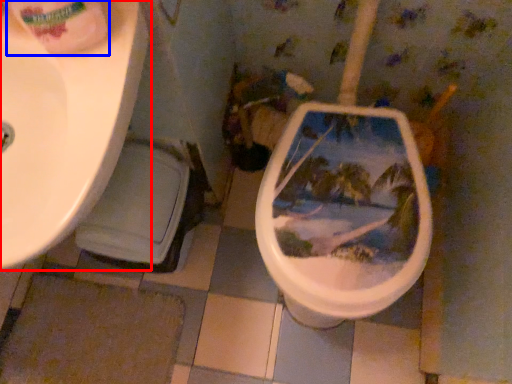
Question: Among these objects, which one is nearest to the camera, sink (highlighted by a red box) or toilet paper (highlighted by a blue box)?

Choices:
 (A) sink
 (B) toilet paper

Answer: (B)